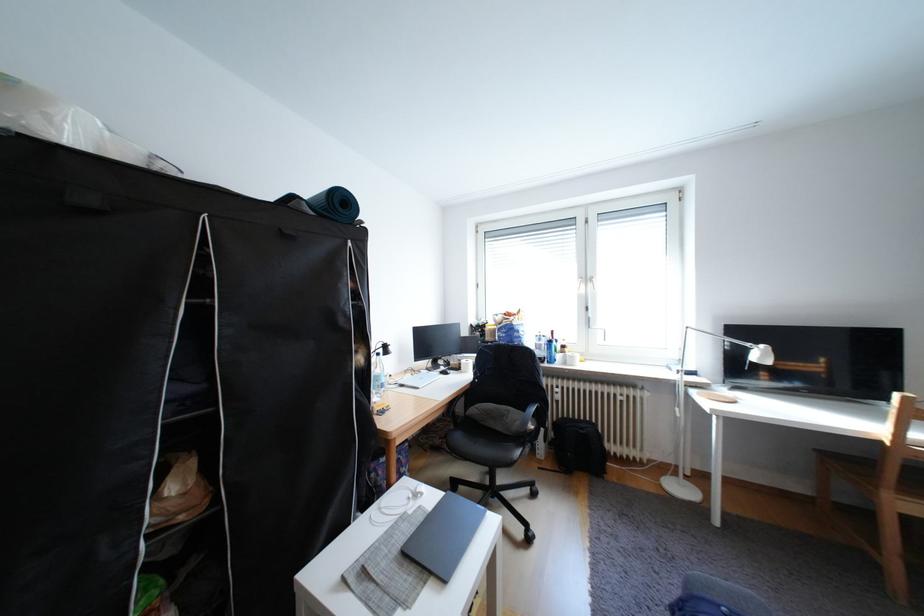
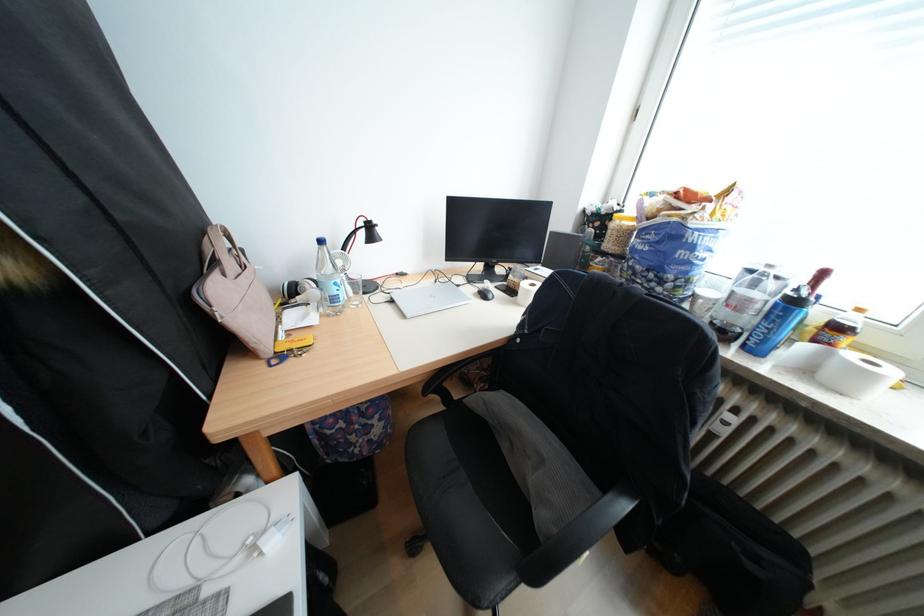
Where in the second image is the point corresponding to (x=578, y=363) from the first image?

(821, 371)